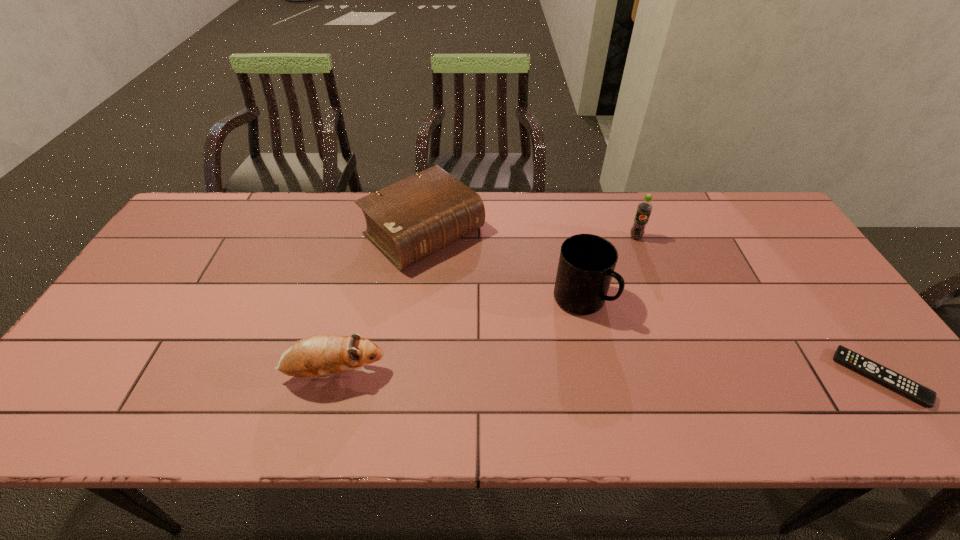
I want to click on hamster that is at the near edge, so click(x=318, y=356).

In order to click on remote control that is at the near edge in this screenshot , I will do `click(867, 367)`.

I want to click on object that is at the right edge, so click(867, 367).

Where is `object that is at the near right corner`? The image size is (960, 540). object that is at the near right corner is located at coordinates (867, 367).

In the image, there is a desktop. In order to click on vacant area at the far edge in this screenshot , I will do point(325,197).

Where is `free location at the near edge`? Image resolution: width=960 pixels, height=540 pixels. free location at the near edge is located at coordinates (596, 374).

The image size is (960, 540). In the image, there is a desktop. What are the coordinates of `vacant space at the left edge` in the screenshot? It's located at (144, 322).

In the image, there is a desktop. Identify the location of vacant space at the right edge. (773, 262).

Locate an element on the screen. empty location between the hamster and the soda is located at coordinates (485, 306).

Image resolution: width=960 pixels, height=540 pixels. What are the coordinates of `free space between the Bible and the hamster` in the screenshot? It's located at (379, 303).